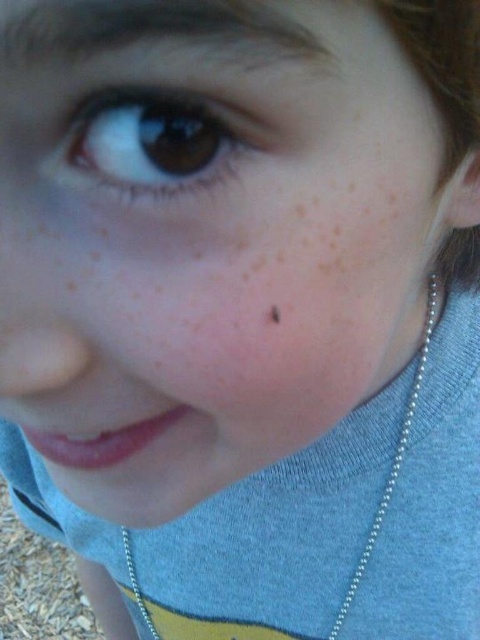
Question: Which object is the farthest from the silver chain at lower center?

Choices:
 (A) brown matte eye at upper left
 (B) brown matte freckle at center

Answer: (A)

Question: Estimate the real-world distances between objects in this image. Which object is closer to the brown matte eye at upper left?

Choices:
 (A) silver chain at lower center
 (B) brown matte freckle at center

Answer: (B)

Question: Is silver chain at lower center bigger than brown matte freckle at center?

Choices:
 (A) no
 (B) yes

Answer: (B)

Question: Based on their relative distances, which object is farther from the brown matte freckle at center?

Choices:
 (A) silver chain at lower center
 (B) brown matte eye at upper left

Answer: (A)

Question: Can you confirm if brown matte eye at upper left is positioned below silver chain at lower center?

Choices:
 (A) yes
 (B) no

Answer: (B)

Question: Is brown matte eye at upper left thinner than brown matte freckle at center?

Choices:
 (A) no
 (B) yes

Answer: (A)